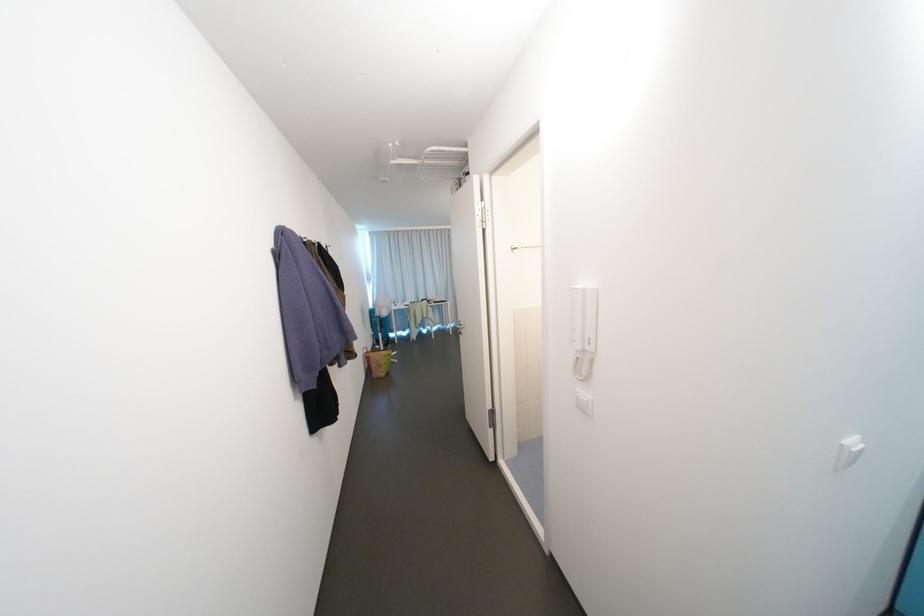
The image size is (924, 616). I want to click on drying rack bar, so click(420, 318).